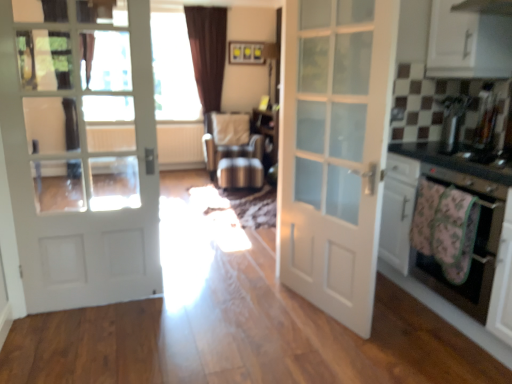
Question: Is pink fabric oven at right directly adjacent to black glossy countertop at right?

Choices:
 (A) no
 (B) yes

Answer: (A)

Question: From a real-world perspective, is pink fabric oven at right beneath black glossy countertop at right?

Choices:
 (A) yes
 (B) no

Answer: (A)

Question: Does pink fabric oven at right lie behind black glossy countertop at right?

Choices:
 (A) yes
 (B) no

Answer: (A)

Question: Is pink fabric oven at right facing towards black glossy countertop at right?

Choices:
 (A) no
 (B) yes

Answer: (A)

Question: Is pink fabric oven at right facing away from black glossy countertop at right?

Choices:
 (A) yes
 (B) no

Answer: (B)

Question: Considering the relative positions of pink fabric oven at right and black glossy countertop at right in the image provided, is pink fabric oven at right to the right of black glossy countertop at right from the viewer's perspective?

Choices:
 (A) no
 (B) yes

Answer: (A)

Question: From a real-world perspective, is white matte door at center, which is the 1th door from right to left, on transparent glass door at upper center?

Choices:
 (A) yes
 (B) no

Answer: (B)

Question: From the image's perspective, does white matte door at center, which is the 1th door from right to left, appear lower than transparent glass door at upper center?

Choices:
 (A) yes
 (B) no

Answer: (A)

Question: Is white matte door at center, the 2th door from the left, not inside transparent glass door at upper center?

Choices:
 (A) no
 (B) yes

Answer: (B)

Question: Considering the relative sizes of white matte door at center, which is the 1th door from right to left, and transparent glass door at upper center in the image provided, is white matte door at center, which is the 1th door from right to left, thinner than transparent glass door at upper center?

Choices:
 (A) no
 (B) yes

Answer: (B)

Question: From a real-world perspective, is white matte door at center, which is the 1th door from right to left, beneath transparent glass door at upper center?

Choices:
 (A) yes
 (B) no

Answer: (A)

Question: Is white matte door at center, the 2th door from the left, further to camera compared to transparent glass door at upper center?

Choices:
 (A) no
 (B) yes

Answer: (A)

Question: Is white glossy cabinet at upper right oriented towards satin silver toaster at upper right?

Choices:
 (A) yes
 (B) no

Answer: (B)